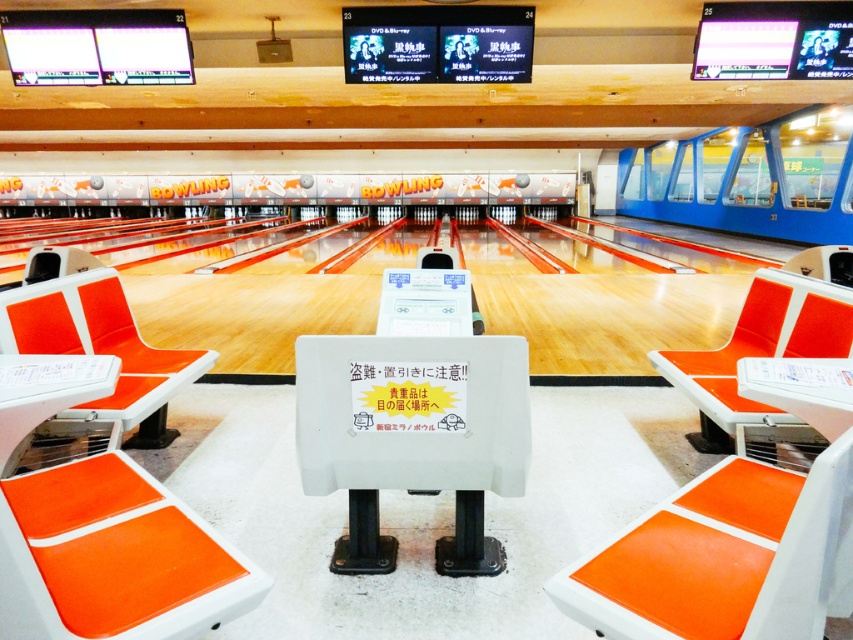
The height and width of the screenshot is (640, 853). What do you see at coordinates (96, 339) in the screenshot? I see `orange plastic chair at left` at bounding box center [96, 339].

How distant is orange plastic chair at left from orange plastic chair at center?

orange plastic chair at left is 3.01 meters from orange plastic chair at center.

Is point (61, 349) in front of point (833, 314)?

No.

Find the location of a particular element. Image resolution: width=853 pixels, height=640 pixels. orange plastic chair at left is located at coordinates (96, 339).

Who is lower down, orange plastic chair at lower left or orange plastic chair at left?

orange plastic chair at lower left is below.

Does point (107, 524) come behind point (148, 349)?

No, (107, 524) is in front of (148, 349).

Is point (248, 588) positioned in front of point (195, 378)?

Yes, point (248, 588) is in front of point (195, 378).

Where is `orange plastic chair at lower left`? The height and width of the screenshot is (640, 853). orange plastic chair at lower left is located at coordinates (112, 557).

Is orange plastic chair at lower left smaller than orange matte seat at center?

Incorrect, orange plastic chair at lower left is not smaller in size than orange matte seat at center.

Locate an element on the screen. The width and height of the screenshot is (853, 640). orange plastic chair at lower left is located at coordinates (112, 557).